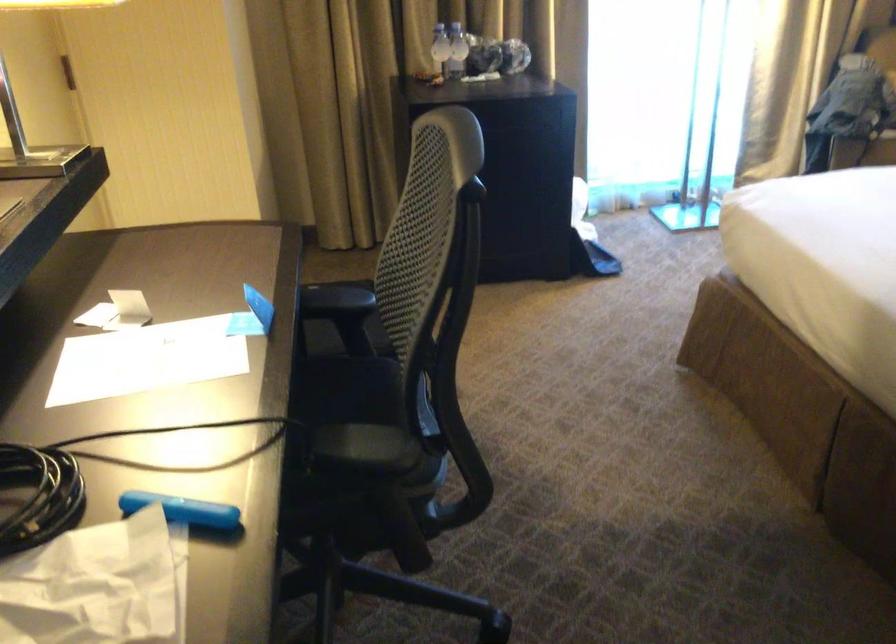
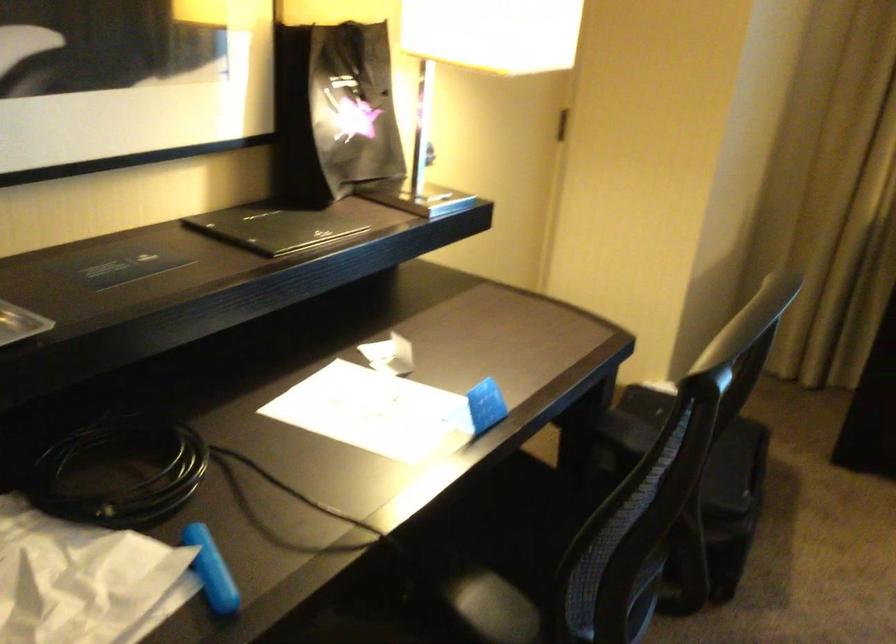
Locate, in the second image, the point that corresponds to pixel 253 308 in the first image.

(479, 408)